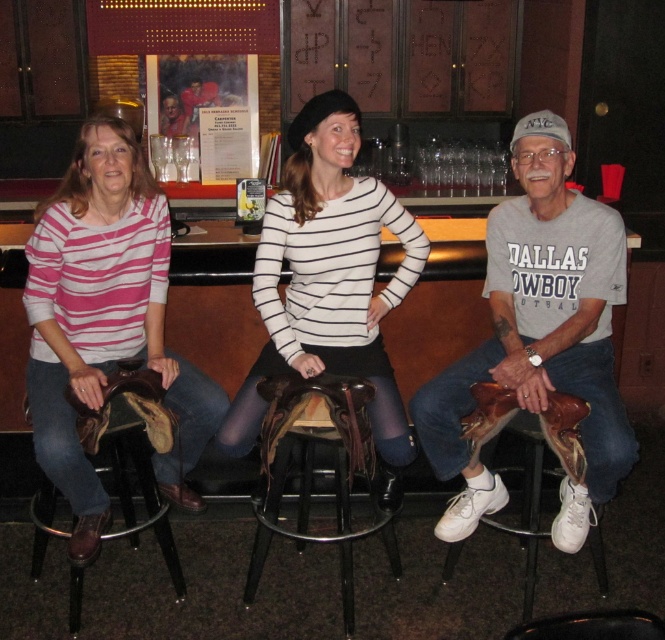
Question: Which object appears closest to the camera in this image?

Choices:
 (A) brown leather saddle at center
 (B) brown leather saddle at left
 (C) matte brown leather saddle at left
 (D) matte brown leather saddle at center

Answer: (A)

Question: Is matte brown leather saddle at right positioned behind brown leather saddle at left?

Choices:
 (A) no
 (B) yes

Answer: (A)

Question: Based on their relative distances, which object is farther from the brown leather saddle at center?

Choices:
 (A) matte brown leather saddle at left
 (B) matte brown leather saddle at right

Answer: (A)

Question: Considering the relative positions of brown leather saddle at center and brown leather saddle at left in the image provided, where is brown leather saddle at center located with respect to brown leather saddle at left?

Choices:
 (A) left
 (B) right

Answer: (B)

Question: Does matte brown leather saddle at left have a lesser width compared to brown leather saddle at center?

Choices:
 (A) yes
 (B) no

Answer: (B)

Question: Which of these objects is positioned closest to the matte brown leather saddle at left?

Choices:
 (A) brown leather saddle at center
 (B) matte brown leather saddle at center
 (C) brown leather saddle at left

Answer: (C)